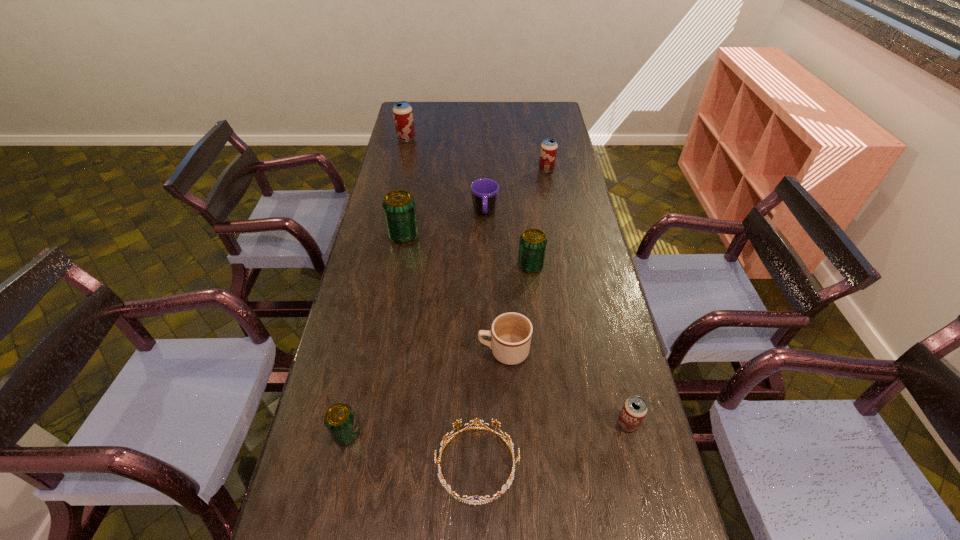
I want to click on black mug, so click(484, 191).

Where is `the farther mug`? the farther mug is located at coordinates (484, 191).

I want to click on the smallest green beer can, so click(x=339, y=419).

Where is `the rightmost object`? This screenshot has width=960, height=540. the rightmost object is located at coordinates (634, 410).

I want to click on the rightmost beer can, so click(634, 410).

Find the location of `the shortest object`. the shortest object is located at coordinates (472, 501).

Where is `vacant space located on the right of the sixth nearest object`? This screenshot has width=960, height=540. vacant space located on the right of the sixth nearest object is located at coordinates (483, 235).

You are a GUI agent. You are given a task and a screenshot of the screen. Output one action in this format:
    pyautogui.click(x=<x>, y=<y>)
    Task: Click on the vacant region located on the right of the farthest beer can
    
    Given the screenshot: What is the action you would take?
    pyautogui.click(x=462, y=139)

I want to click on vacant region located on the back of the second farthest red beer can, so click(x=540, y=139).

Where is `free space located on the right of the third nearest beer can`? free space located on the right of the third nearest beer can is located at coordinates (567, 266).